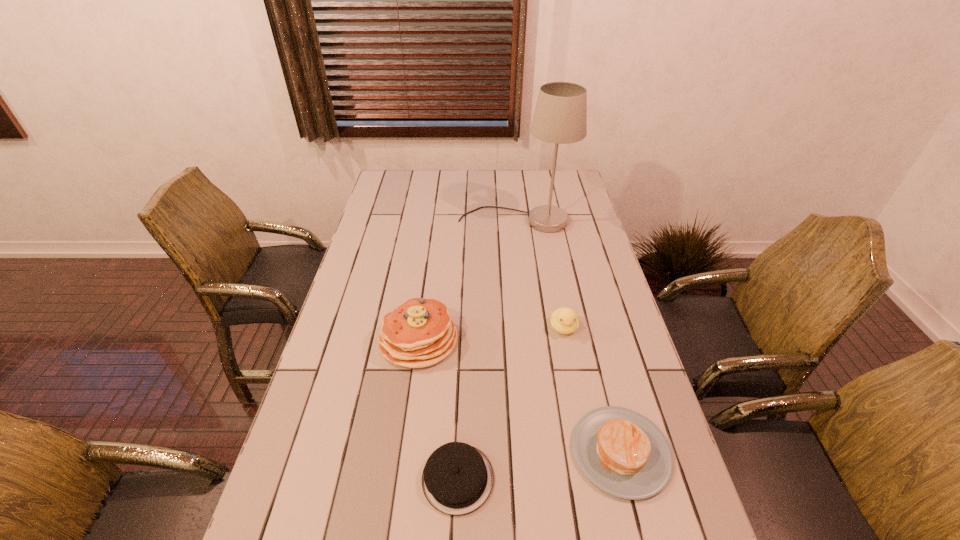
Image resolution: width=960 pixels, height=540 pixels. I want to click on table lamp, so click(560, 117).

The width and height of the screenshot is (960, 540). I want to click on the farthest object, so click(560, 117).

Image resolution: width=960 pixels, height=540 pixels. I want to click on the farthest pancake, so click(x=419, y=333).

Identify the location of the tallest pancake. (419, 333).

Where is `the third tallest object`? This screenshot has height=540, width=960. the third tallest object is located at coordinates (564, 320).

Find the location of a particular element. the second shortest pancake is located at coordinates (623, 453).

Where is `the second shortest object`? the second shortest object is located at coordinates (623, 453).

Where is `the shortest object`? The image size is (960, 540). the shortest object is located at coordinates (457, 479).

At what (x,y) coordinates should I click in order to perform the action: click on blank area located on the front of the farthest object. Please return your answer as a coordinate pair (x, y). Looking at the image, I should click on (524, 308).

Locate an element on the screen. The height and width of the screenshot is (540, 960). vacant space positioned 0.310m on the back of the farthest pancake is located at coordinates (430, 251).